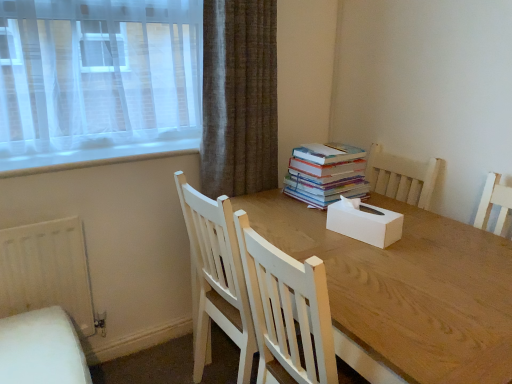
Find the location of a particular element. This screenshot has width=512, height=384. vacant area in front of white cardboard tissue box at center is located at coordinates (371, 253).